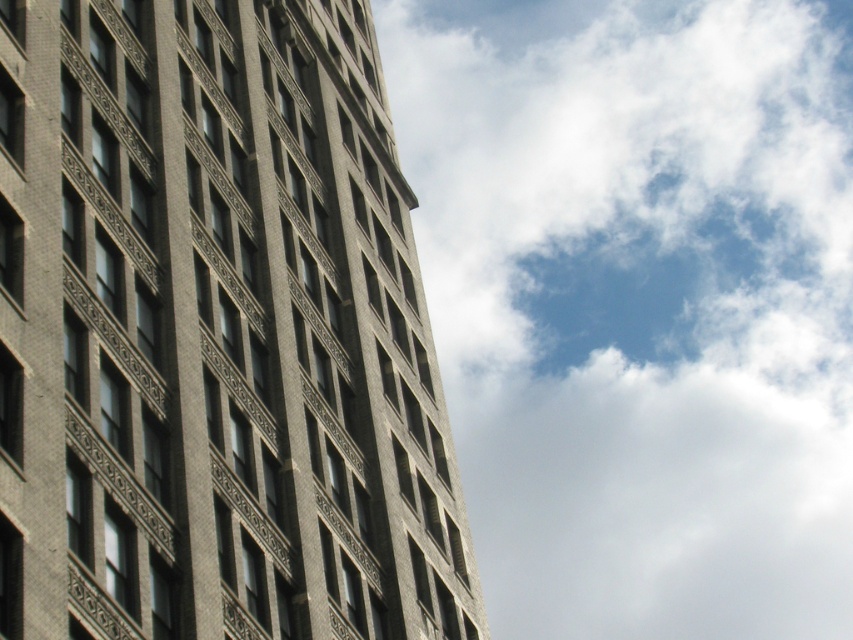
Does gray brick building at center appear on the right side of white fluffy cloud at upper right?

In fact, gray brick building at center is to the left of white fluffy cloud at upper right.

Find the location of a particular element. The width and height of the screenshot is (853, 640). gray brick building at center is located at coordinates (215, 333).